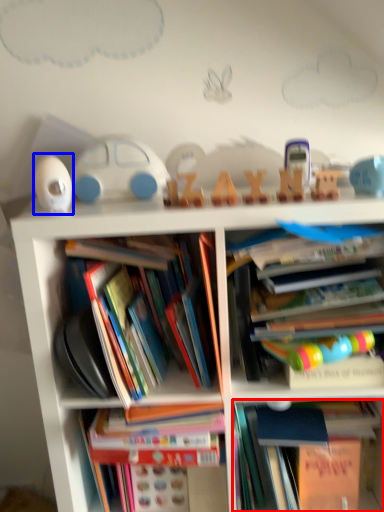
Question: Which object appears farthest to the camera in this image, book (highlighted by a red box) or toy (highlighted by a blue box)?

Choices:
 (A) book
 (B) toy

Answer: (A)